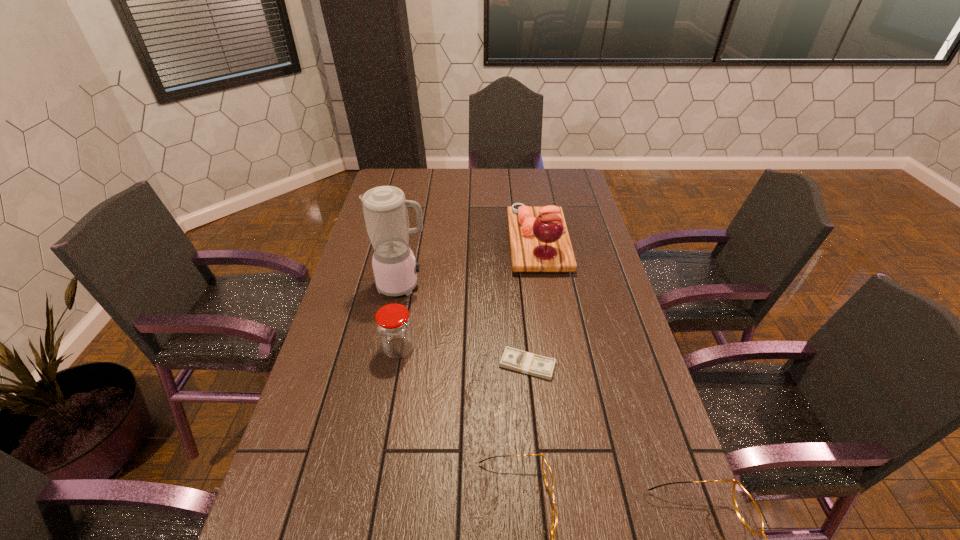
Considering the uniform spacing of spectacless, where should an additional spectacles be positioned on the left? Please locate a free spot. Please provide its 2D coordinates. Your answer should be formatted as a tuple, i.e. [(x, y)], where the tuple contains the x and y coordinates of a point satisfying the conditions above.

[(345, 470)]